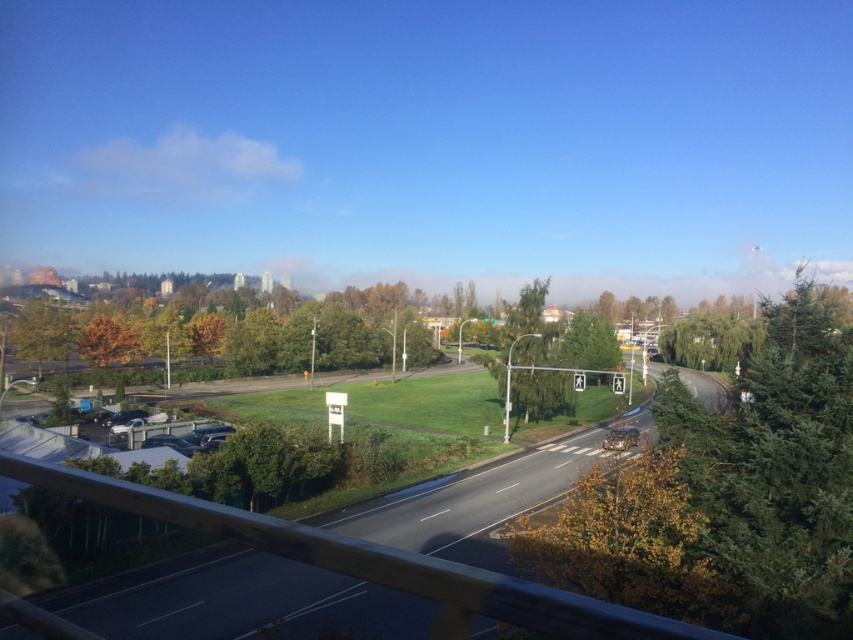
Question: Does asphalt road at center appear on the left side of green matte tree at upper left?

Choices:
 (A) no
 (B) yes

Answer: (A)

Question: Based on their relative distances, which object is nearer to the green leafy tree at center?

Choices:
 (A) asphalt road at center
 (B) green matte tree at upper left

Answer: (A)

Question: Can you confirm if asphalt road at center is positioned to the right of orange matte tree at left?

Choices:
 (A) yes
 (B) no

Answer: (A)

Question: Among these objects, which one is farthest from the camera?

Choices:
 (A) orange matte tree at left
 (B) asphalt road at center

Answer: (A)

Question: Which point is closer to the camera?

Choices:
 (A) orange matte tree at left
 (B) green matte tree at upper left
 (C) asphalt road at center

Answer: (C)

Question: Can you confirm if green leafy tree at center is positioned to the left of orange matte tree at left?

Choices:
 (A) yes
 (B) no

Answer: (B)